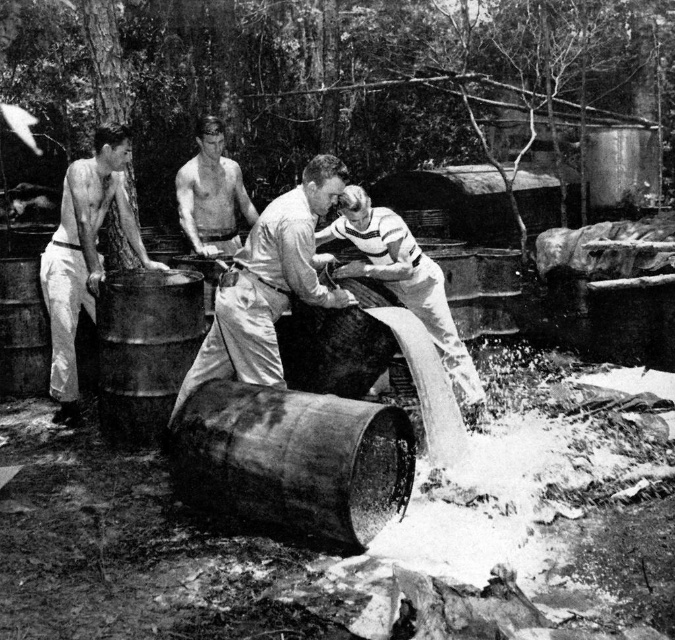
Question: Which object appears closest to the camera in this image?

Choices:
 (A) smooth white shirt at center
 (B) smooth white shirt at left

Answer: (A)

Question: Considering the real-world distances, which object is closest to the metallic barrel at center?

Choices:
 (A) smooth white shirt at center
 (B) smooth white shirt at left
 (C) smooth leather jacket at center

Answer: (B)

Question: Does smooth white shirt at left have a greater width compared to smooth skin torso at center?

Choices:
 (A) no
 (B) yes

Answer: (B)

Question: Where is smooth leather jacket at center located in relation to smooth skin torso at center in the image?

Choices:
 (A) left
 (B) right

Answer: (B)

Question: Does rusty metallic barrel at center lie in front of smooth leather jacket at center?

Choices:
 (A) yes
 (B) no

Answer: (A)

Question: Which object is the closest to the smooth white shirt at center?

Choices:
 (A) smooth white shirt at left
 (B) rusty metallic barrel at center
 (C) smooth leather jacket at center
 (D) smooth skin torso at center

Answer: (B)